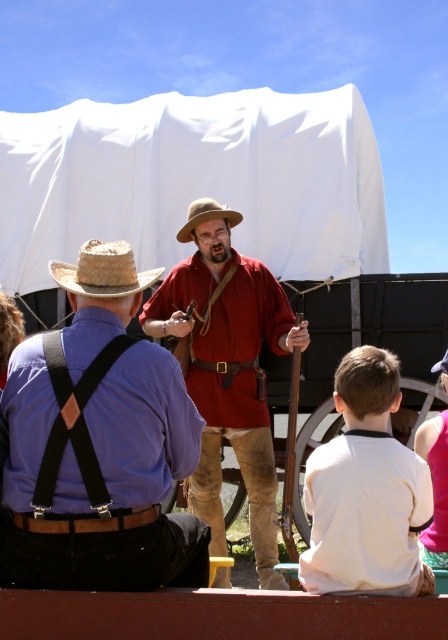
You are a photographer trying to capture a portrait of both the pink fabric shirt at lower right and the tan straw cowboy hat at center. Based on their positions, can you fit both subjects into the frame without moving the camera?

The pink fabric shirt at lower right is below the tan straw cowboy hat at center, so if the camera frame can accommodate vertical space, both can be included.

You are standing at the point marked by the coordinates point (103, 269). Which object is directly in front of you?

The point (103, 269) marks the strawhat at left, so the object directly in front of you is the strawhat at left.